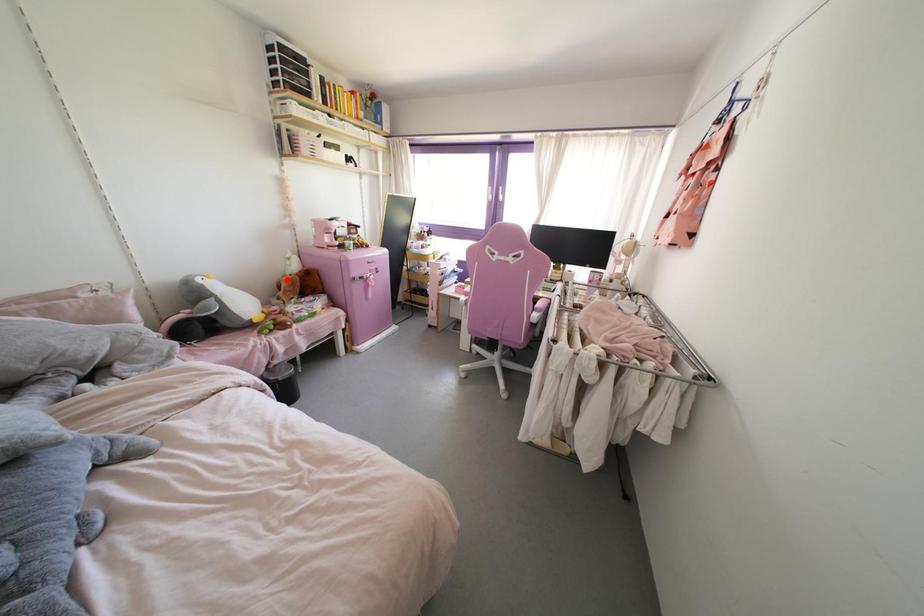
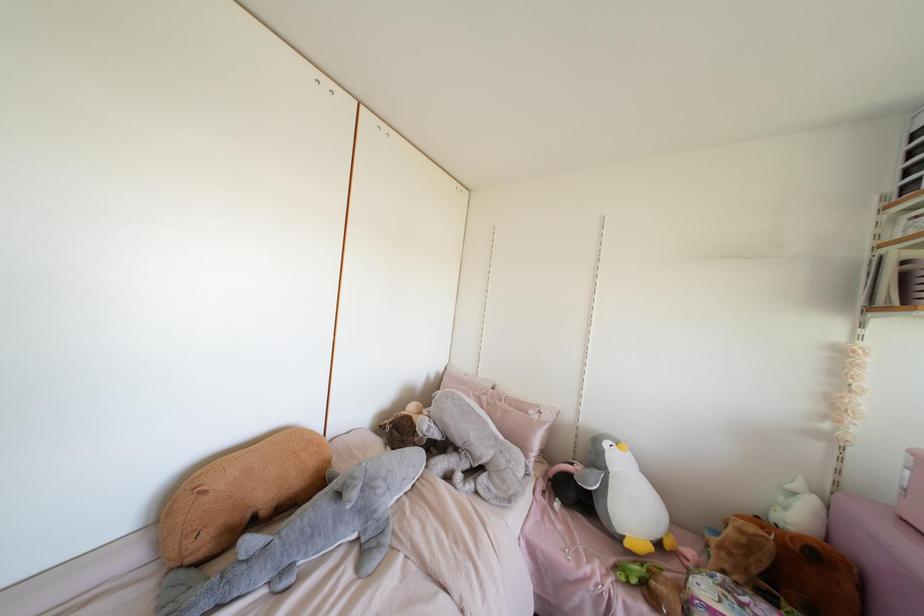
Locate, in the second image, the point that corresponds to the highlighted location in the first image.

(739, 531)